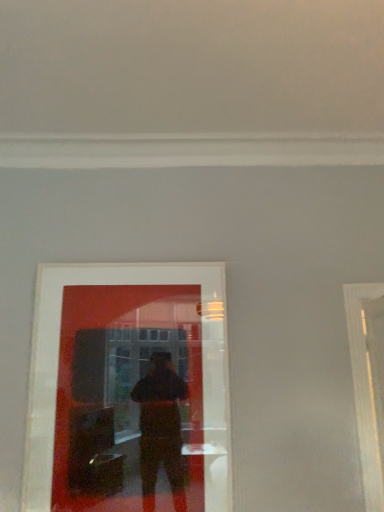
Question: From the image's perspective, relative to white glossy door at right, is matte glass picture frame at center above or below?

Choices:
 (A) above
 (B) below

Answer: (A)

Question: Choose the correct answer: Is matte glass picture frame at center inside white glossy door at right or outside it?

Choices:
 (A) outside
 (B) inside

Answer: (A)

Question: In terms of size, does matte glass picture frame at center appear bigger or smaller than white glossy door at right?

Choices:
 (A) small
 (B) big

Answer: (A)

Question: Is point (367, 382) positioned closer to the camera than point (196, 348)?

Choices:
 (A) closer
 (B) farther

Answer: (A)

Question: From the image's perspective, is white glossy door at right positioned above or below matte glass picture frame at center?

Choices:
 (A) below
 (B) above

Answer: (A)

Question: Looking at their shapes, would you say white glossy door at right is wider or thinner than matte glass picture frame at center?

Choices:
 (A) thin
 (B) wide

Answer: (B)

Question: In terms of height, does white glossy door at right look taller or shorter compared to matte glass picture frame at center?

Choices:
 (A) short
 (B) tall

Answer: (A)